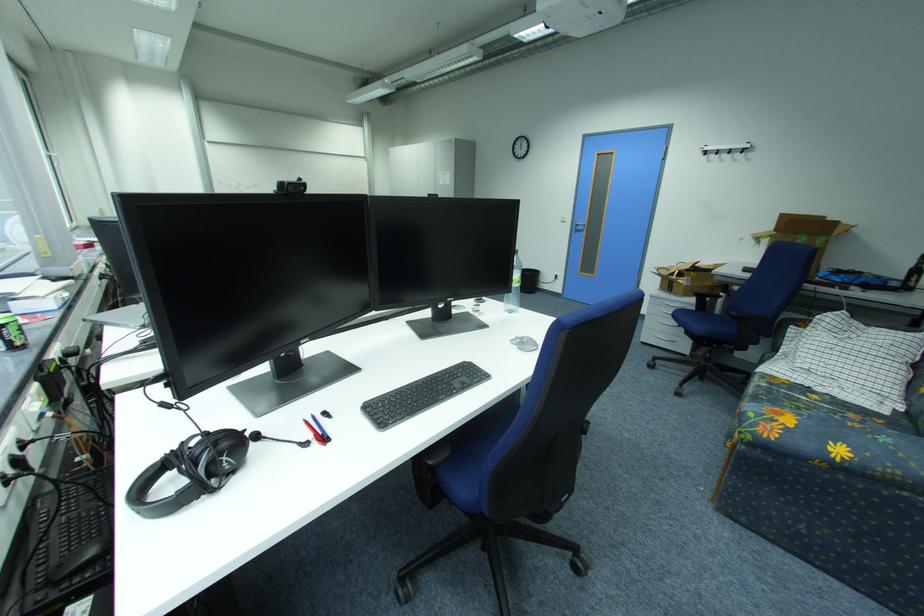
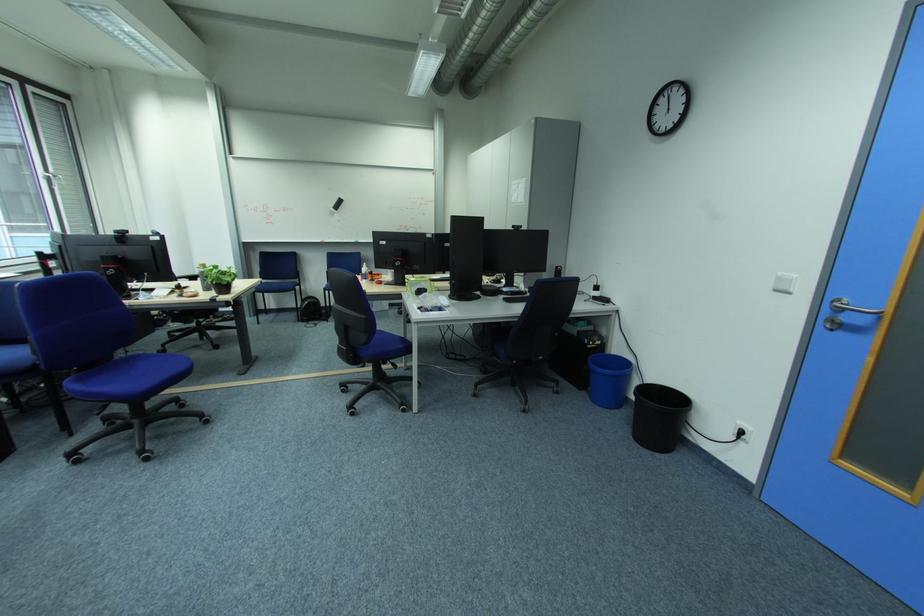
Find the pixel in the second image that matches point 570,223 in the first image.

(785, 292)